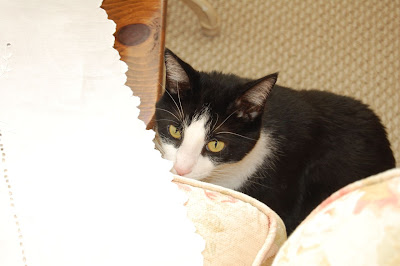
Where is `rug`? This screenshot has height=266, width=400. rug is located at coordinates click(x=332, y=41).